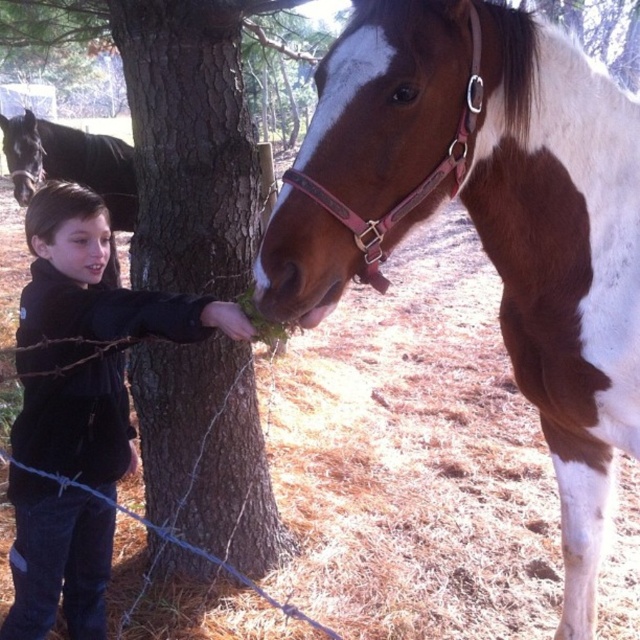
Does brown rough bark tree at center appear on the right side of black fleece jacket at left?

Correct, you'll find brown rough bark tree at center to the right of black fleece jacket at left.

I want to click on brown rough bark tree at center, so click(189, 141).

Identify the location of brown and white speckled horse at center. (490, 220).

Locate an element on the screen. The width and height of the screenshot is (640, 640). brown and white speckled horse at center is located at coordinates (490, 220).

Does brown and white speckled horse at center have a greater width compared to brown rough bark tree at center?

Yes.

Between brown and white speckled horse at center and brown rough bark tree at center, which one appears on the right side from the viewer's perspective?

brown and white speckled horse at center is more to the right.

Between point (364, 273) and point (141, 355), which one is positioned in front?

Point (364, 273)

Image resolution: width=640 pixels, height=640 pixels. Identify the location of brown and white speckled horse at center. (490, 220).